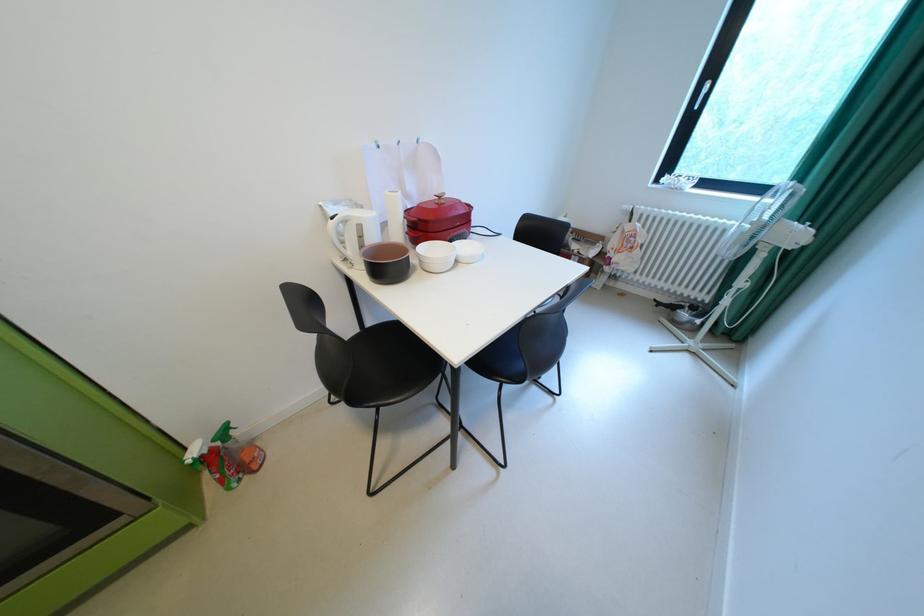
Where would you squeez the green spray bottle trigger? Please return your answer as a coordinate pair (x, y).

(223, 432)